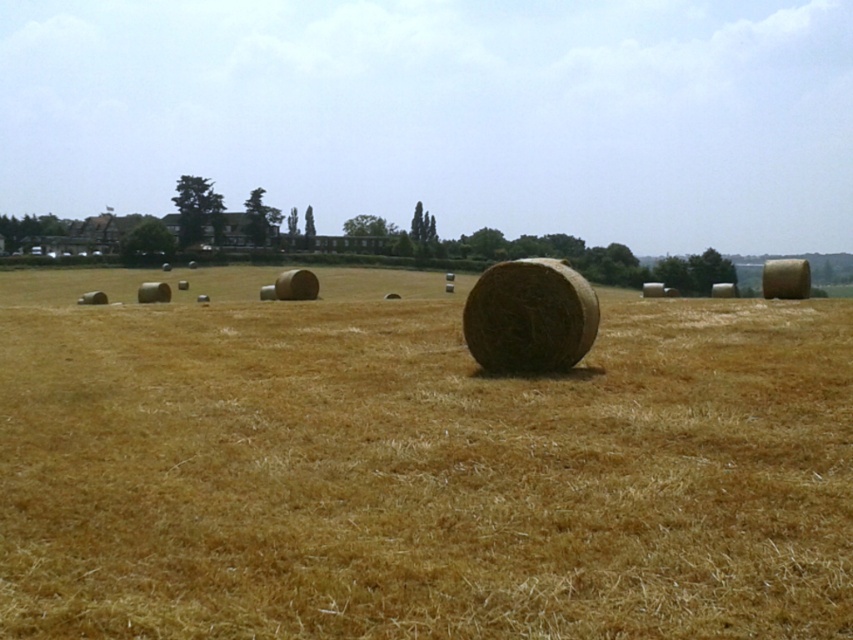
Consider the image. You are a farmer checking the hay bales in your field. You notice two items at the center of the field labeled as dry straw at center and natural straw bale at center. Which one is taller?

The dry straw at center is much taller than the natural straw bale at center according to the description.